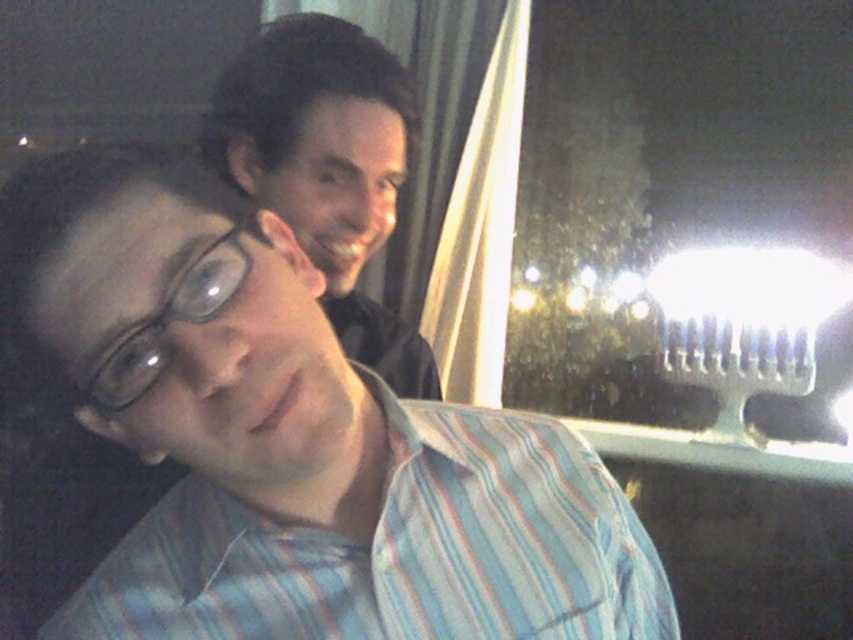
You are a photographer trying to focus on the striped cotton shirt at center and the transparent plastic glasses at upper left. Which object should you adjust your camera focus on first if you want to start from the nearest object to the farthest?

You should first focus on the transparent plastic glasses at upper left because it is located above the striped cotton shirt at center, making it closer to the camera.

You are standing in front of the image and want to touch the two points mentioned. Which point, point (627, 625) or point (404, 80), will require you to reach further forward to touch it?

Point (404, 80) will require you to reach further forward because it is farther from the viewer compared to point (627, 625).

Based on the coordinates provided, which object corresponds to the point at location (x=328, y=168)?

The point at location (x=328, y=168) corresponds to the matte black shirt at upper center.